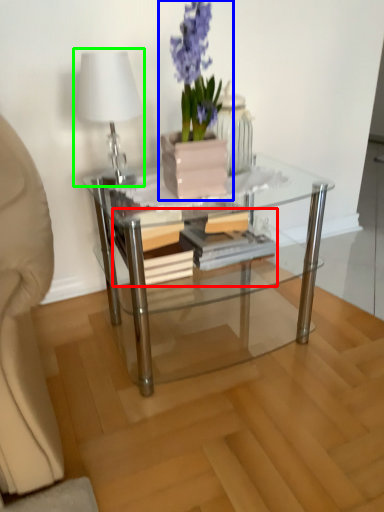
Question: Based on their relative distances, which object is farther from book (highlighted by a red box)? Choose from houseplant (highlighted by a blue box) and table lamp (highlighted by a green box).

Choices:
 (A) houseplant
 (B) table lamp

Answer: (B)